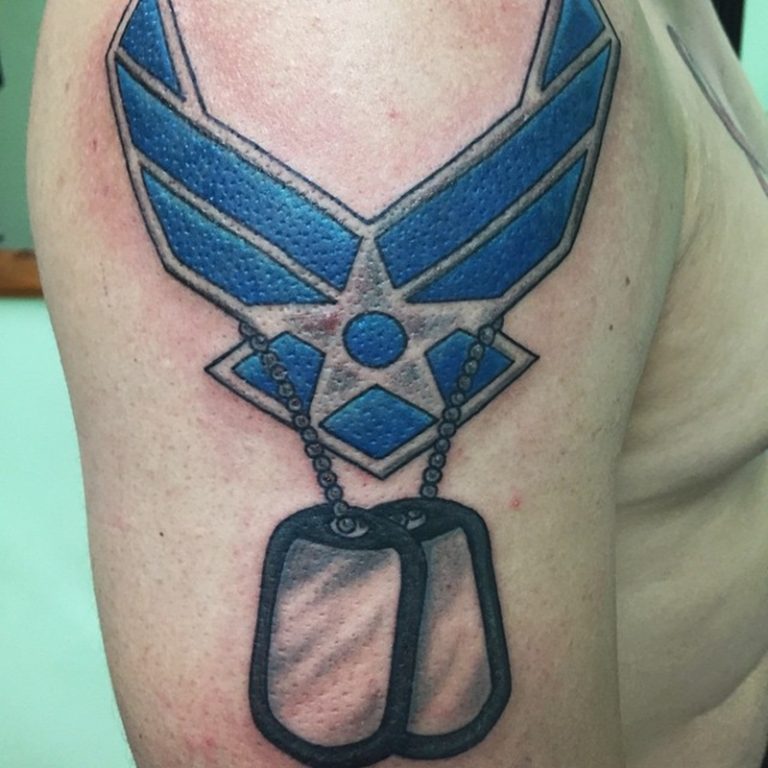
The width and height of the screenshot is (768, 768). Identify the location of wooden beam. (20, 272).